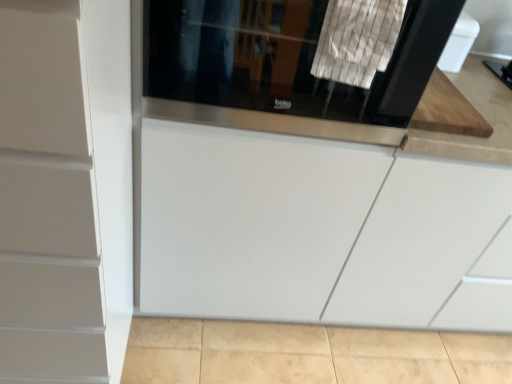
Question: From the image's perspective, is white striped fabric at upper center located beneath black glass screen door at upper center?

Choices:
 (A) yes
 (B) no

Answer: (A)

Question: Can you confirm if white striped fabric at upper center is bigger than black glass screen door at upper center?

Choices:
 (A) yes
 (B) no

Answer: (B)

Question: Is white striped fabric at upper center not inside black glass screen door at upper center?

Choices:
 (A) yes
 (B) no

Answer: (B)

Question: Can you confirm if white striped fabric at upper center is positioned to the right of black glass screen door at upper center?

Choices:
 (A) yes
 (B) no

Answer: (A)

Question: Considering the relative sizes of white striped fabric at upper center and black glass screen door at upper center in the image provided, is white striped fabric at upper center wider than black glass screen door at upper center?

Choices:
 (A) no
 (B) yes

Answer: (A)

Question: Considering the positions of white striped fabric at upper center and white matte cabinet at left in the image, is white striped fabric at upper center taller or shorter than white matte cabinet at left?

Choices:
 (A) short
 (B) tall

Answer: (A)

Question: Does point (362, 72) appear closer or farther from the camera than point (103, 105)?

Choices:
 (A) closer
 (B) farther

Answer: (B)

Question: From a real-world perspective, is white striped fabric at upper center physically located above or below white matte cabinet at left?

Choices:
 (A) above
 (B) below

Answer: (A)

Question: Based on their sizes in the image, would you say white striped fabric at upper center is bigger or smaller than white matte cabinet at left?

Choices:
 (A) big
 (B) small

Answer: (B)

Question: Looking at the image, does black glass screen door at upper center seem bigger or smaller compared to white striped fabric at upper center?

Choices:
 (A) small
 (B) big

Answer: (B)

Question: Relative to white striped fabric at upper center, is black glass screen door at upper center in front or behind?

Choices:
 (A) front
 (B) behind

Answer: (B)

Question: From the image's perspective, is black glass screen door at upper center above or below white striped fabric at upper center?

Choices:
 (A) above
 (B) below

Answer: (A)

Question: Does point (163, 69) appear closer or farther from the camera than point (350, 61)?

Choices:
 (A) farther
 (B) closer

Answer: (A)

Question: Is white striped fabric at upper center in front of or behind black glass screen door at upper center in the image?

Choices:
 (A) behind
 (B) front

Answer: (B)

Question: From the image's perspective, is white striped fabric at upper center located above or below black glass screen door at upper center?

Choices:
 (A) above
 (B) below

Answer: (B)